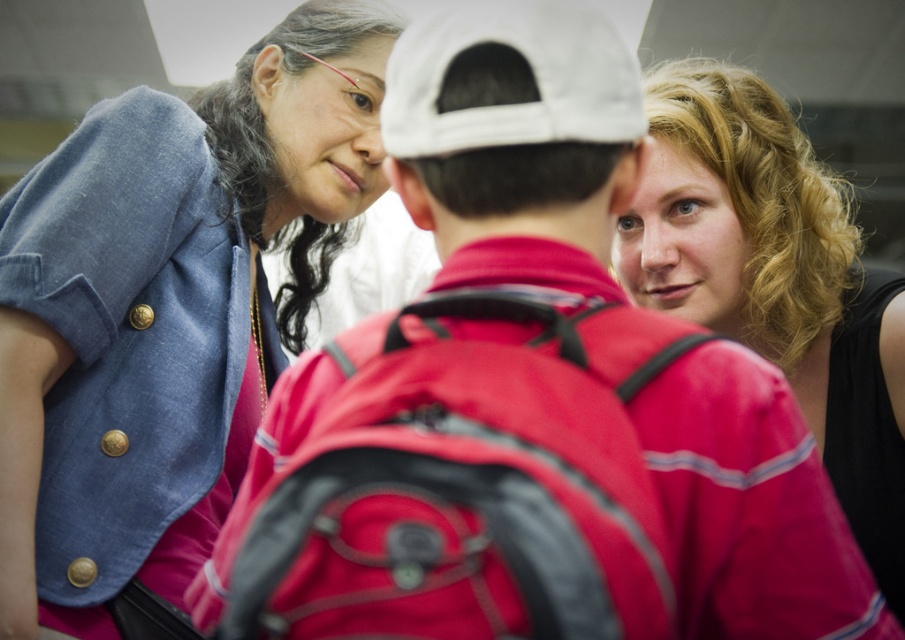
Question: Is denim jacket at upper left above white fabric baseball cap at center?

Choices:
 (A) yes
 (B) no

Answer: (B)

Question: Which point is farther from the camera taking this photo?

Choices:
 (A) (294, 10)
 (B) (424, 58)
 (C) (786, 253)

Answer: (A)

Question: Which point is farther from the camera taking this photo?

Choices:
 (A) (129, 182)
 (B) (475, 36)
 (C) (688, 316)

Answer: (C)

Question: In this image, where is blonde curly hair at upper right located relative to white fabric baseball cap at center?

Choices:
 (A) above
 (B) below

Answer: (B)

Question: Does denim jacket at upper left appear on the right side of blonde curly hair at upper right?

Choices:
 (A) yes
 (B) no

Answer: (B)

Question: Which point is closer to the camera?

Choices:
 (A) (234, 339)
 (B) (626, 67)
 (C) (891, 440)

Answer: (B)